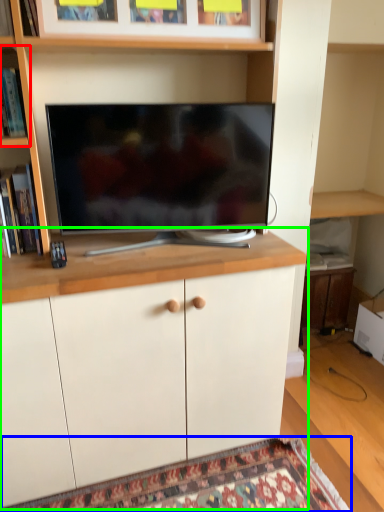
Question: Which object is the closest to the shelf (highlighted by a red box)? Choose among these: mat (highlighted by a blue box) or cabinetry (highlighted by a green box).

Choices:
 (A) mat
 (B) cabinetry

Answer: (B)